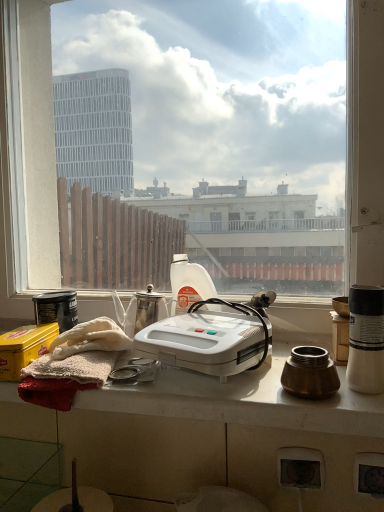
Identify the location of white plastic waffle maker at center. (209, 339).

In order to face white plastic waffle maker at center, should I rotate leftwards or rightwards?

Turn right by 0.942 degrees to look at white plastic waffle maker at center.

Image resolution: width=384 pixels, height=512 pixels. Describe the element at coordinates (24, 348) in the screenshot. I see `yellow matte tin at lower left` at that location.

Where is `transparent glass window at center`? The image size is (384, 512). transparent glass window at center is located at coordinates (27, 152).

Describe the element at coordinates (310, 373) in the screenshot. I see `matte brown jar at right, placed as the first appliance when sorted from front to back` at that location.

Where is `white plastic bottle at center`? This screenshot has height=512, width=384. white plastic bottle at center is located at coordinates (188, 284).

What do you see at coordinates (149, 308) in the screenshot? The width and height of the screenshot is (384, 512). I see `metallic silver teapot at center, which is the second appliance in right-to-left order` at bounding box center [149, 308].

This screenshot has width=384, height=512. Find the location of `white plastic waffle maker at center`. white plastic waffle maker at center is located at coordinates (209, 339).

Is white glossy table at center not near white plastic bottle at center?

They are positioned close to each other.

Does white glossy table at center turn towards white plastic bottle at center?

No, white glossy table at center is not turned towards white plastic bottle at center.

Considering the sizes of objects white glossy table at center and white plastic bottle at center in the image provided, who is bigger, white glossy table at center or white plastic bottle at center?

With larger size is white glossy table at center.

Can you confirm if matte black canister at left, marked as the 2th appliance in a back-to-front arrangement, is smaller than white glossy coffee cup at right?

Incorrect, matte black canister at left, marked as the 2th appliance in a back-to-front arrangement, is not smaller in size than white glossy coffee cup at right.

Does matte black canister at left, the third appliance positioned from the right, appear on the right side of white glossy coffee cup at right?

Incorrect, matte black canister at left, the third appliance positioned from the right, is not on the right side of white glossy coffee cup at right.

Considering the positions of objects matte black canister at left, the third appliance positioned from the right, and white glossy coffee cup at right in the image provided, who is in front, matte black canister at left, the third appliance positioned from the right, or white glossy coffee cup at right?

white glossy coffee cup at right is in front.

Is matte black canister at left, the 1th appliance viewed from the left, positioned beyond the bounds of white glossy coffee cup at right?

Absolutely, matte black canister at left, the 1th appliance viewed from the left, is external to white glossy coffee cup at right.

In terms of width, does metallic silver power plugs and sockets at lower center look wider or thinner when compared to matte brown jar at right, the third appliance viewed from the back?

In the image, metallic silver power plugs and sockets at lower center appears to be more narrow than matte brown jar at right, the third appliance viewed from the back.

From the image's perspective, is metallic silver power plugs and sockets at lower center under matte brown jar at right, which appears as the 3th appliance when viewed from the left?

Indeed, from the image's perspective, metallic silver power plugs and sockets at lower center is shown beneath matte brown jar at right, which appears as the 3th appliance when viewed from the left.

Which object is positioned more to the right, metallic silver power plugs and sockets at lower center or matte brown jar at right, positioned as the 1th appliance in right-to-left order?

Positioned to the right is matte brown jar at right, positioned as the 1th appliance in right-to-left order.

Who is smaller, white plastic bottle at center or matte brown jar at right, placed as the first appliance when sorted from front to back?

Smaller between the two is matte brown jar at right, placed as the first appliance when sorted from front to back.

Considering the sizes of objects white plastic bottle at center and matte brown jar at right, positioned as the 1th appliance in right-to-left order, in the image provided, who is shorter, white plastic bottle at center or matte brown jar at right, positioned as the 1th appliance in right-to-left order,?

matte brown jar at right, positioned as the 1th appliance in right-to-left order, is shorter.

Is white plastic bottle at center touching matte brown jar at right, the third appliance viewed from the back?

No.

In the scene shown: Could you tell me if white plastic bottle at center is turned towards matte brown jar at right, the third appliance viewed from the back?

No, white plastic bottle at center is not turned towards matte brown jar at right, the third appliance viewed from the back.

Is point (150, 312) closer or farther from the camera than point (237, 329)?

Point (150, 312) appears to be farther away from the viewer than point (237, 329).

Consider the image. Which is more to the left, metallic silver teapot at center, marked as the 1th appliance in a back-to-front arrangement, or white plastic waffle maker at center?

metallic silver teapot at center, marked as the 1th appliance in a back-to-front arrangement.

In order to click on the 1st appliance to the left when counting from the white plastic waffle maker at center in this screenshot , I will do `click(149, 308)`.

Which is correct: metallic silver teapot at center, marked as the 1th appliance in a back-to-front arrangement, is inside white plastic waffle maker at center, or outside of it?

metallic silver teapot at center, marked as the 1th appliance in a back-to-front arrangement, is not inside white plastic waffle maker at center, it's outside.

From a real-world perspective, is matte black canister at left, the third appliance positioned from the right, on top of yellow matte tin at lower left?

Yes, from a real-world perspective, matte black canister at left, the third appliance positioned from the right, is on top of yellow matte tin at lower left.

What's the angular difference between matte black canister at left, marked as the 2th appliance in a back-to-front arrangement, and yellow matte tin at lower left's facing directions?

The facing directions of matte black canister at left, marked as the 2th appliance in a back-to-front arrangement, and yellow matte tin at lower left are 1.4 degrees apart.

Could you tell me if matte black canister at left, which is counted as the 2th appliance, starting from the front, is facing yellow matte tin at lower left?

Yes, matte black canister at left, which is counted as the 2th appliance, starting from the front, is aimed at yellow matte tin at lower left.

From the image's perspective, who appears lower, matte black canister at left, which is counted as the 2th appliance, starting from the front, or yellow matte tin at lower left?

yellow matte tin at lower left appears lower in the image.

Considering the sizes of objects white glossy table at center and matte black canister at left, the 1th appliance viewed from the left, in the image provided, who is shorter, white glossy table at center or matte black canister at left, the 1th appliance viewed from the left,?

white glossy table at center is shorter.

Is there a large distance between white glossy table at center and matte black canister at left, the 1th appliance viewed from the left?

No, white glossy table at center is not far from matte black canister at left, the 1th appliance viewed from the left.

Is point (182, 469) closer or farther from the camera than point (35, 304)?

Point (182, 469) appears to be closer to the viewer than point (35, 304).

How different are the orientations of white glossy table at center and matte black canister at left, marked as the 2th appliance in a back-to-front arrangement, in degrees?

The facing directions of white glossy table at center and matte black canister at left, marked as the 2th appliance in a back-to-front arrangement, are 3.51 degrees apart.

Where is `table in front of the white plastic bottle at center`? table in front of the white plastic bottle at center is located at coordinates (209, 436).

Find the location of a particular element. Image resolution: width=384 pixels, height=512 pixels. coffee cup to the right of matte black canister at left, the third appliance positioned from the right is located at coordinates (366, 339).

Based on their spatial positions, is white plastic bottle at center or transparent glass window at center further from matte black canister at left, marked as the 2th appliance in a back-to-front arrangement?

Based on the image, transparent glass window at center appears to be further to matte black canister at left, marked as the 2th appliance in a back-to-front arrangement.

Estimate the real-world distances between objects in this image. Which object is closer to white glossy coffee cup at right, transparent glass window at center or white glossy table at center?

white glossy table at center lies closer to white glossy coffee cup at right than the other object.

Estimate the real-world distances between objects in this image. Which object is further from white plastic waffle maker at center, metallic silver power plugs and sockets at lower center or yellow matte tin at lower left?

The object further to white plastic waffle maker at center is yellow matte tin at lower left.

Looking at this image, based on their spatial positions, is matte brown jar at right, the third appliance viewed from the back, or yellow matte tin at lower left closer to metallic silver teapot at center, marked as the 1th appliance in a back-to-front arrangement?

Among the two, yellow matte tin at lower left is located nearer to metallic silver teapot at center, marked as the 1th appliance in a back-to-front arrangement.

From the image, which object appears to be farther from white glossy table at center, metallic silver teapot at center, which ranks as the 2th appliance in left-to-right order, or yellow matte tin at lower left?

yellow matte tin at lower left lies further to white glossy table at center than the other object.

Based on their spatial positions, is metallic silver teapot at center, which is the second appliance in right-to-left order, or matte brown jar at right, placed as the first appliance when sorted from front to back, further from white plastic waffle maker at center?

The object further to white plastic waffle maker at center is metallic silver teapot at center, which is the second appliance in right-to-left order.

Looking at the image, which one is located closer to white glossy table at center, white plastic bottle at center or white glossy coffee cup at right?

white glossy coffee cup at right lies closer to white glossy table at center than the other object.

Looking at this image, from the image, which object appears to be farther from matte black canister at left, marked as the 2th appliance in a back-to-front arrangement, white glossy table at center or metallic silver power plugs and sockets at lower center?

Based on the image, metallic silver power plugs and sockets at lower center appears to be further to matte black canister at left, marked as the 2th appliance in a back-to-front arrangement.

Where is `power plugs and sockets located between white glossy coffee cup at right and white plastic bottle at center in the depth direction`? power plugs and sockets located between white glossy coffee cup at right and white plastic bottle at center in the depth direction is located at coordinates (300, 468).

At what (x,y) coordinates should I click in order to perform the action: click on table located between yellow matte tin at lower left and white plastic bottle at center in the left-right direction. Please return your answer as a coordinate pair (x, y). This screenshot has height=512, width=384. Looking at the image, I should click on (209, 436).

The height and width of the screenshot is (512, 384). Find the location of `coffee cup between transparent glass window at center and white plastic waffle maker at center in the vertical direction`. coffee cup between transparent glass window at center and white plastic waffle maker at center in the vertical direction is located at coordinates point(366,339).

The width and height of the screenshot is (384, 512). What are the coordinates of `power plugs and sockets between matte brown jar at right, placed as the first appliance when sorted from front to back, and white plastic bottle at center in the front-back direction` in the screenshot? It's located at (300, 468).